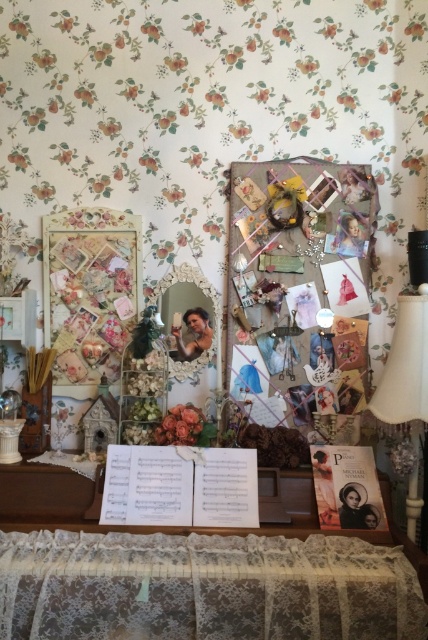
From the picture: How far apart are floral paper collage at left and matte floral bouquet at center?

floral paper collage at left is 20.11 inches away from matte floral bouquet at center.

Measure the distance between point [76,349] and camera.

Point [76,349] is 6.76 feet away from camera.

Is point (136, 300) positioned behind point (166, 436)?

That is True.

You are a GUI agent. You are given a task and a screenshot of the screen. Output one action in this format:
    pyautogui.click(x=<x>, y=<y>)
    Task: Click on the floral paper collage at left
    The height and width of the screenshot is (640, 428).
    Given the screenshot: What is the action you would take?
    pyautogui.click(x=89, y=289)

Describe the element at coordinates (205, 588) in the screenshot. I see `lace fabric tablecloth at lower center` at that location.

Is lace fabric tablecloth at lower center bigger than gold ornate mirror at center?

Yes, lace fabric tablecloth at lower center is bigger than gold ornate mirror at center.

Is point (193, 534) less distant than point (192, 280)?

That is True.

The image size is (428, 640). I want to click on lace fabric tablecloth at lower center, so click(205, 588).

Does lace fabric tablecloth at lower center have a greater width compared to matte floral bouquet at center?

Yes, lace fabric tablecloth at lower center is wider than matte floral bouquet at center.

Is point (353, 630) more distant than point (184, 426)?

No, it is not.

Find the location of a particular element. lace fabric tablecloth at lower center is located at coordinates (205, 588).